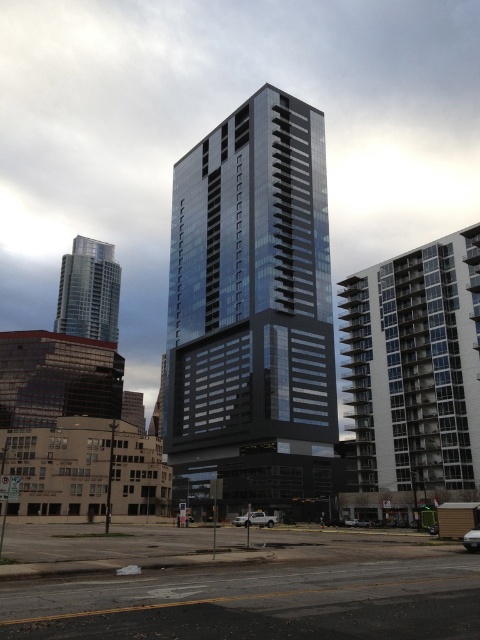
Question: Considering the real-world distances, which object is closest to the white matte truck at lower center?

Choices:
 (A) shiny silver skyscraper at left
 (B) white matte truck at center

Answer: (B)

Question: Which object is farther from the camera taking this photo?

Choices:
 (A) white matte truck at lower center
 (B) white matte truck at center
 (C) silver metallic car at center

Answer: (B)

Question: Is white matte truck at lower center above white matte truck at center?

Choices:
 (A) no
 (B) yes

Answer: (B)

Question: Which of the following is the farthest from the observer?

Choices:
 (A) shiny silver skyscraper at left
 (B) white matte car at center
 (C) glassy metallic building at center

Answer: (A)

Question: Is shiny silver skyscraper at left above white matte truck at lower center?

Choices:
 (A) no
 (B) yes

Answer: (B)

Question: Is glassy metallic building at center further to the viewer compared to shiny silver skyscraper at left?

Choices:
 (A) no
 (B) yes

Answer: (A)